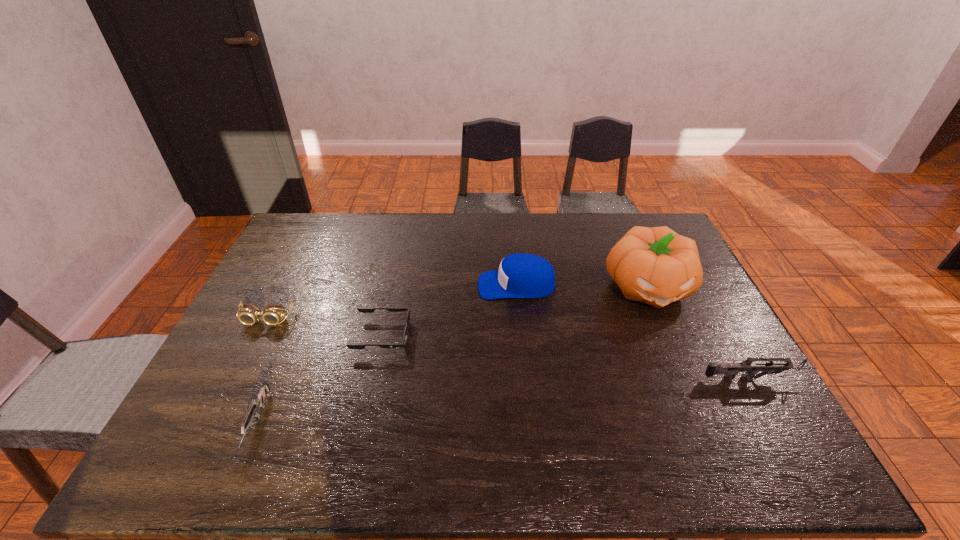
If equal spacing is desired by inserting an extra gun among them, please point out a free spot for this new gun. Please provide its 2D coordinates. Your answer should be formatted as a tuple, i.e. [(x, y)], where the tuple contains the x and y coordinates of a point satisfying the conditions above.

[(516, 400)]